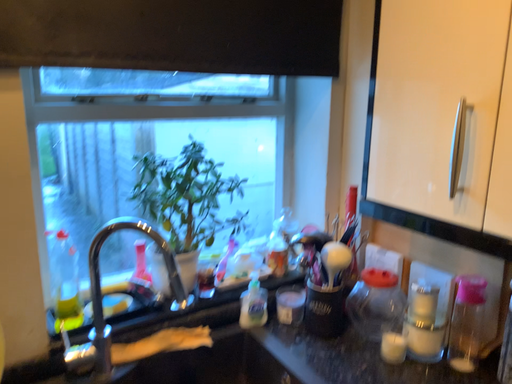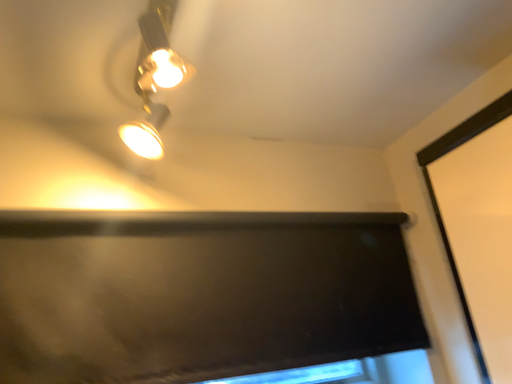
Question: How did the camera likely rotate when shooting the video?

Choices:
 (A) rotated downward
 (B) rotated upward

Answer: (B)